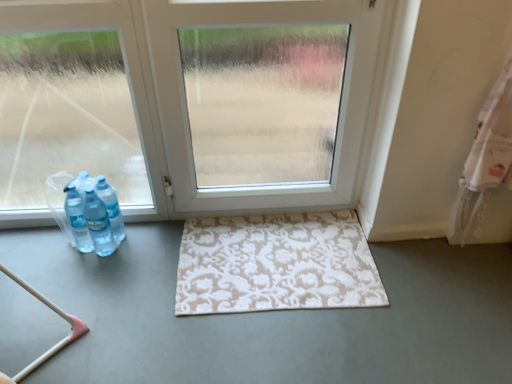
What are the coordinates of `free space between translucent plastic bottles at left and beige patterned rug at center` in the screenshot? It's located at (147, 258).